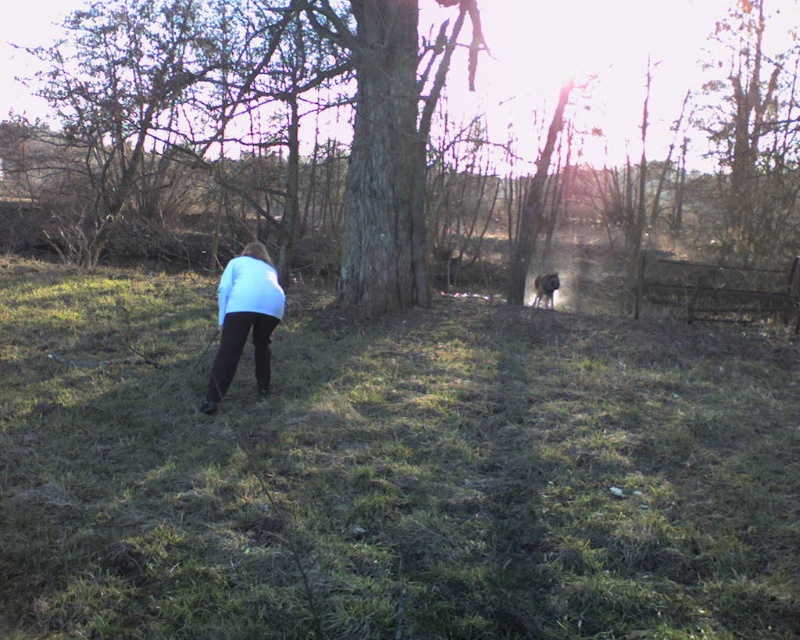
Looking at this image, can you confirm if green grassy at center is positioned above rough bark tree at center?

No, green grassy at center is not above rough bark tree at center.

Does green grassy at center appear on the right side of rough bark tree at center?

No, green grassy at center is not to the right of rough bark tree at center.

Is point (632, 522) less distant than point (654, 99)?

Yes, point (632, 522) is in front of point (654, 99).

You are a GUI agent. You are given a task and a screenshot of the screen. Output one action in this format:
    pyautogui.click(x=<x>, y=<y>)
    Task: Click on the green grassy at center
    The height and width of the screenshot is (640, 800).
    Given the screenshot: What is the action you would take?
    pyautogui.click(x=388, y=474)

Describe the element at coordinates (586, 65) in the screenshot. Image resolution: width=800 pixels, height=640 pixels. I see `rough bark tree at center` at that location.

Is point (540, 93) less distant than point (546, 296)?

No, it is not.

Does point (546, 83) lie behind point (533, 285)?

Yes, it is.

Locate an element on the screen. This screenshot has height=640, width=800. rough bark tree at center is located at coordinates (586, 65).

Who is higher up, rough bark tree at center or light blue fabric at center?

rough bark tree at center is higher up.

Describe the element at coordinates (586, 65) in the screenshot. The width and height of the screenshot is (800, 640). I see `rough bark tree at center` at that location.

Who is more distant from viewer, (698, 72) or (226, 353)?

Positioned behind is point (698, 72).

I want to click on rough bark tree at center, so click(586, 65).